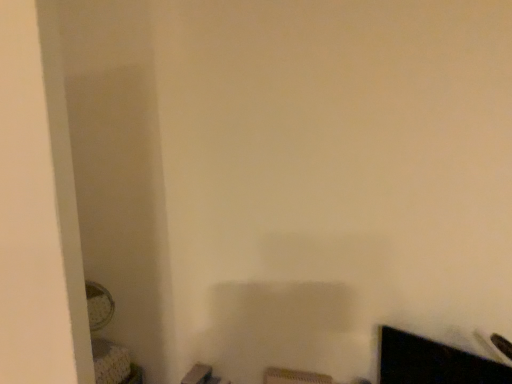
Question: Should I look upward or downward to see black glossy monitor at bottom right?

Choices:
 (A) down
 (B) up

Answer: (A)